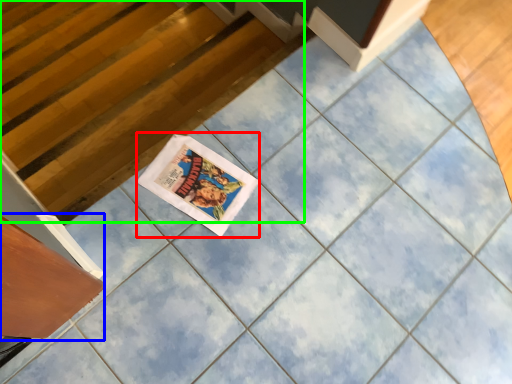
Question: Which is nearer to the comic book (highlighted by a red box)? drawer (highlighted by a blue box) or stairwell (highlighted by a green box).

Choices:
 (A) drawer
 (B) stairwell

Answer: (A)